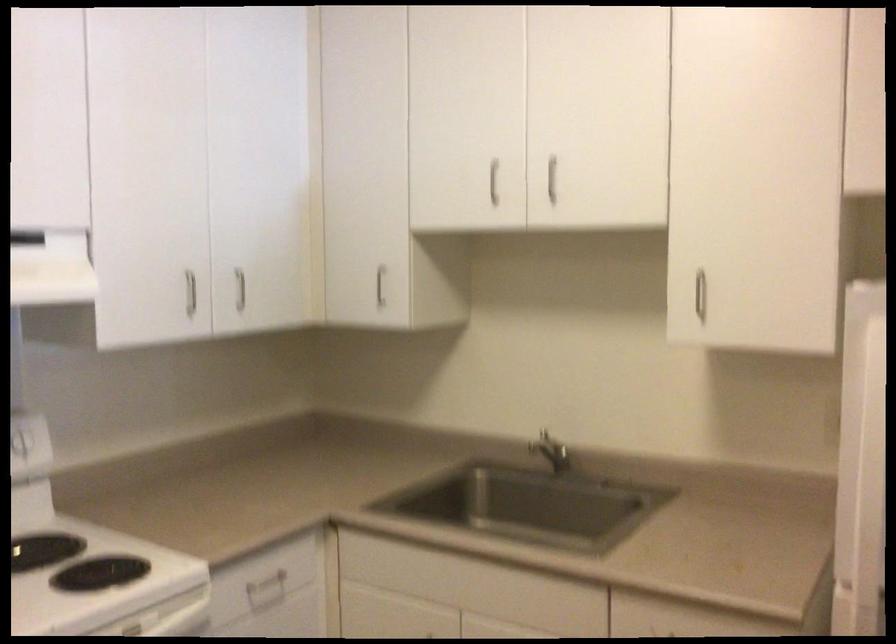
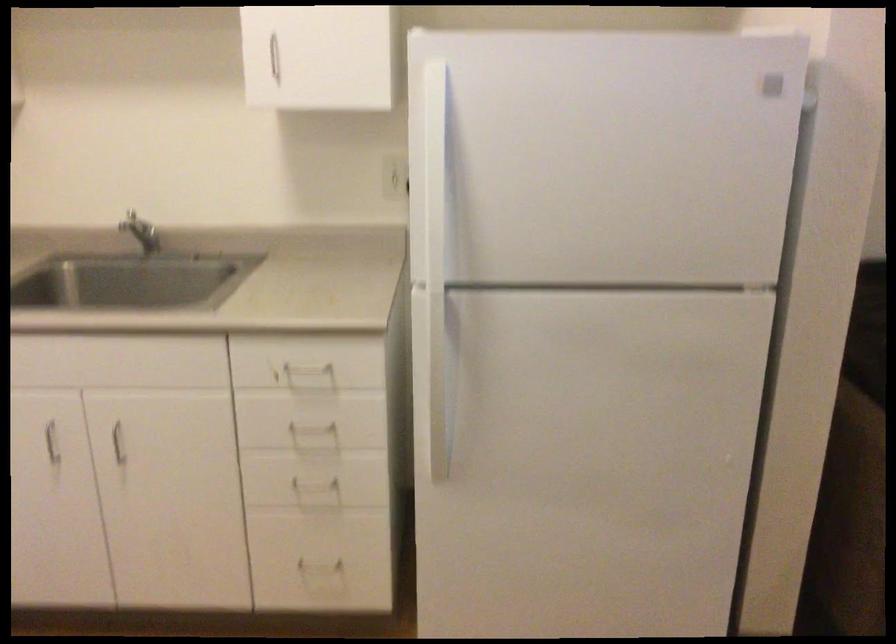
In the second image, find the point that corresponds to pixel 700 290 in the first image.

(270, 59)